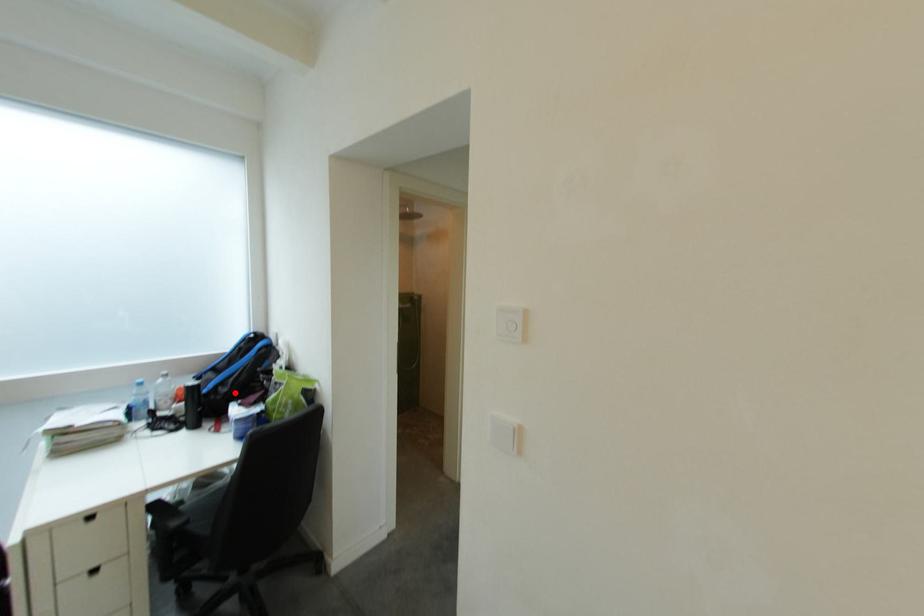
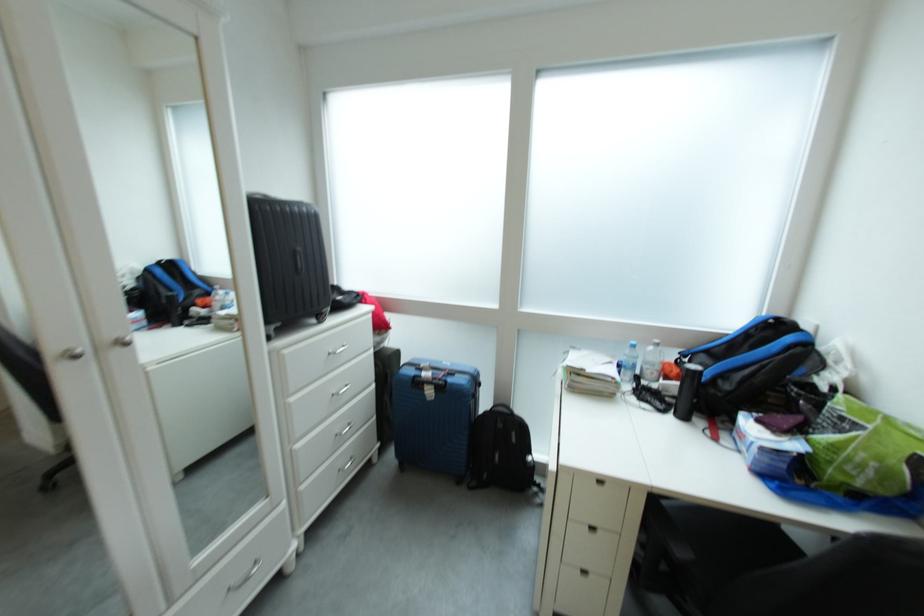
In the second image, find the point that corresponds to the highlighted location in the first image.

(737, 390)